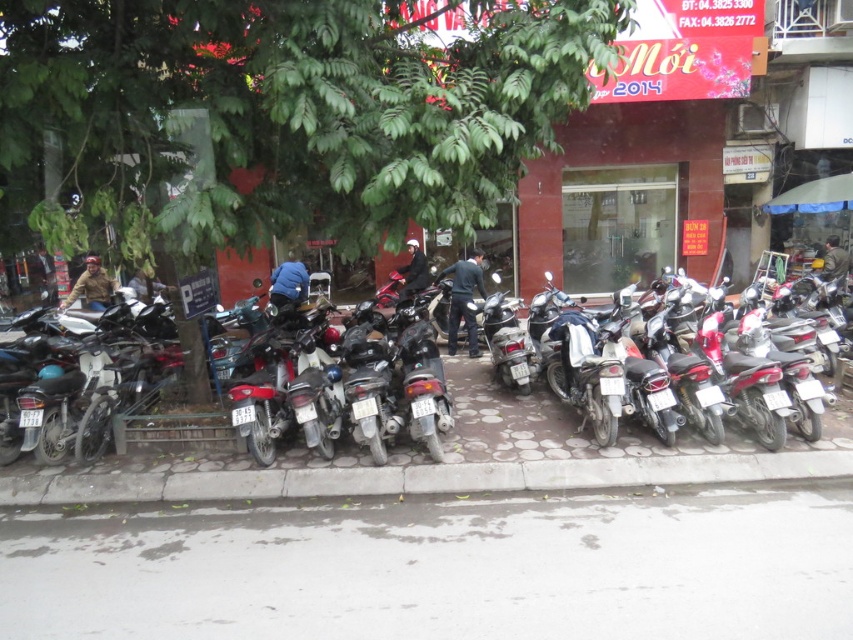
You are a delivery person who needs to pick up a package from the store located behind the tree. You see the metallic silver motorcycle at center and the matte brown helmet at left. Which object is closer to the store entrance?

The matte brown helmet at left is closer to the store entrance because the metallic silver motorcycle at center is positioned on the right side of it, meaning the helmet is between the motorcycle and the store.

Based on the photo, you are standing at the camera position looking at the busy street scene. There is a point marked at coordinates point [229,573]. If you want to place a 2 meter tall flagpole at this point, will it be visible from your current position?

The point [229,573] is 4.57 meters from the camera. Since the flagpole is 2 meters tall, it will be visible from the current position as it is within the line of sight and not obstructed by the tree or other objects in the scene.

You are a delivery person who needs to load a large package onto the metallic silver motorcycle at center. The package requires at least 1.2 meters of vertical clearance. Can the matte brown helmet at left, which is taller than the motorcycle, help you determine if the motorcycle has enough space?

The metallic silver motorcycle at center is not as tall as the matte brown helmet at left. Since the helmet is taller than the motorcycle, if the helmet can fit within the 1.2 meters requirement, then the motorcycle also can. However, if the helmet exceeds 1.2 meters, the motorcycle might be too short. You need to measure the helmet first.